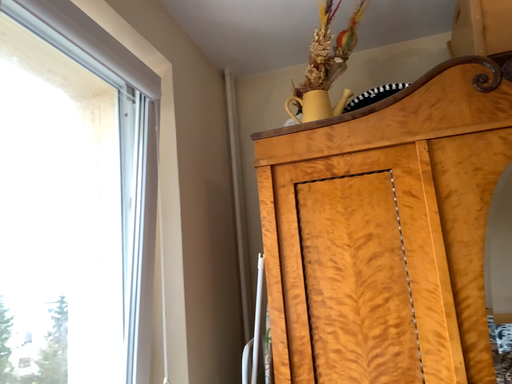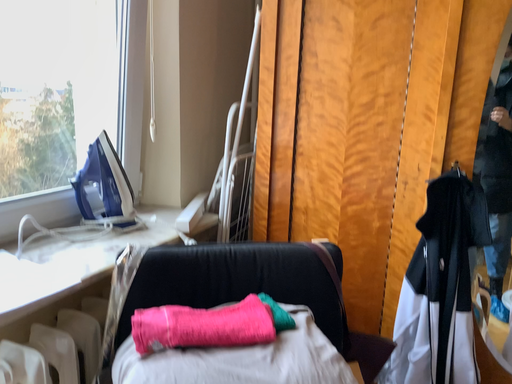
Question: How did the camera likely rotate when shooting the video?

Choices:
 (A) rotated downward
 (B) rotated upward

Answer: (A)